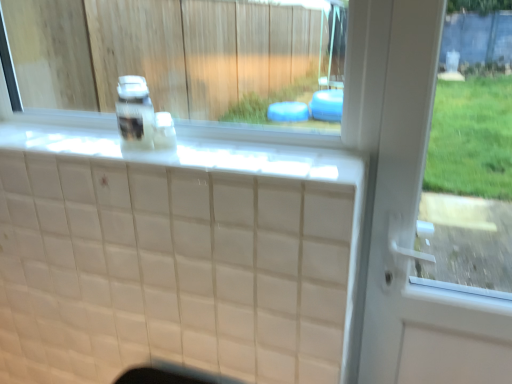
Question: Is white glossy ledge at upper center bigger or smaller than clear plastic bottle at center, marked as the second bottle in a right-to-left arrangement?

Choices:
 (A) small
 (B) big

Answer: (B)

Question: Considering the positions of white glossy ledge at upper center and clear plastic bottle at center, which is counted as the 1th bottle, starting from the left, in the image, is white glossy ledge at upper center taller or shorter than clear plastic bottle at center, which is counted as the 1th bottle, starting from the left,?

Choices:
 (A) tall
 (B) short

Answer: (B)

Question: Which is nearer to the translucent plastic bottle at center, marked as the second bottle in a left-to-right arrangement?

Choices:
 (A) white glossy window sill at upper center
 (B) clear plastic bottle at center, marked as the second bottle in a right-to-left arrangement
 (C) white glossy ledge at upper center

Answer: (B)

Question: Which is farther from the white glossy window sill at upper center?

Choices:
 (A) clear plastic bottle at center, marked as the second bottle in a right-to-left arrangement
 (B) translucent plastic bottle at center, acting as the first bottle starting from the right
 (C) white glossy ledge at upper center

Answer: (B)